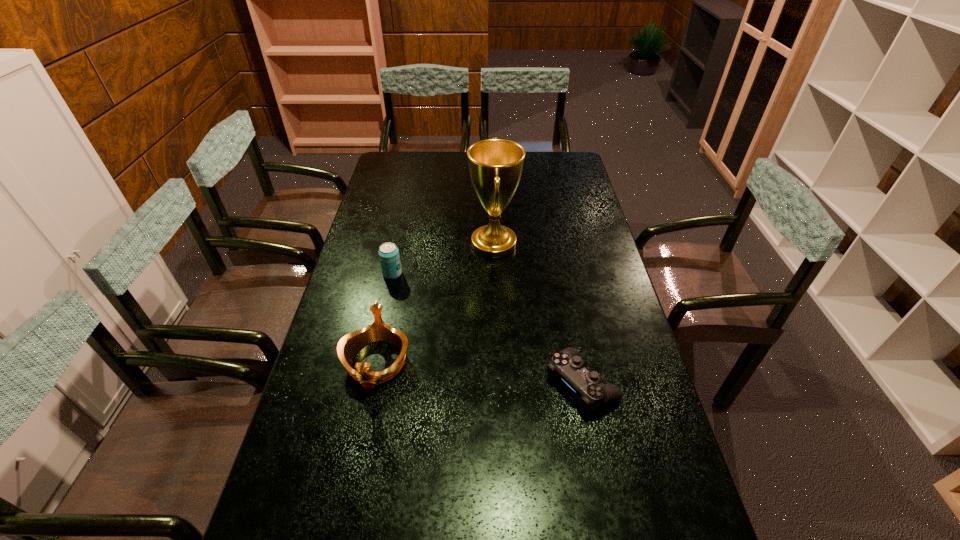
Locate which object ranks in proximity to the tiara. Please provide its 2D coordinates. Your answer should be formatted as a tuple, i.e. [(x, y)], where the tuple contains the x and y coordinates of a point satisfying the conditions above.

[(389, 256)]

Image resolution: width=960 pixels, height=540 pixels. I want to click on free space that satisfies the following two spatial constraints: 1. by the handles of the tallest object; 2. on the back side of the control, so click(499, 383).

I want to click on free location that satisfies the following two spatial constraints: 1. at the front emblem of the control; 2. on the left side of the tiara, so click(x=372, y=383).

The width and height of the screenshot is (960, 540). In order to click on free location that satisfies the following two spatial constraints: 1. on the back side of the rightmost object; 2. by the handles of the third object from left to right in this screenshot , I will do `click(554, 244)`.

Image resolution: width=960 pixels, height=540 pixels. I want to click on free spot that satisfies the following two spatial constraints: 1. by the handles of the award; 2. at the front emblem of the tiara, so click(498, 362).

Image resolution: width=960 pixels, height=540 pixels. I want to click on vacant space that satisfies the following two spatial constraints: 1. by the handles of the tallest object; 2. at the front emblem of the tiara, so (498, 362).